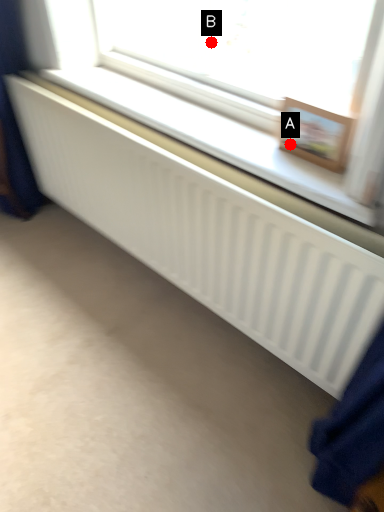
Question: Two points are circled on the image, labeled by A and B beside each circle. Which point is closer to the camera?

Choices:
 (A) A is closer
 (B) B is closer

Answer: (A)